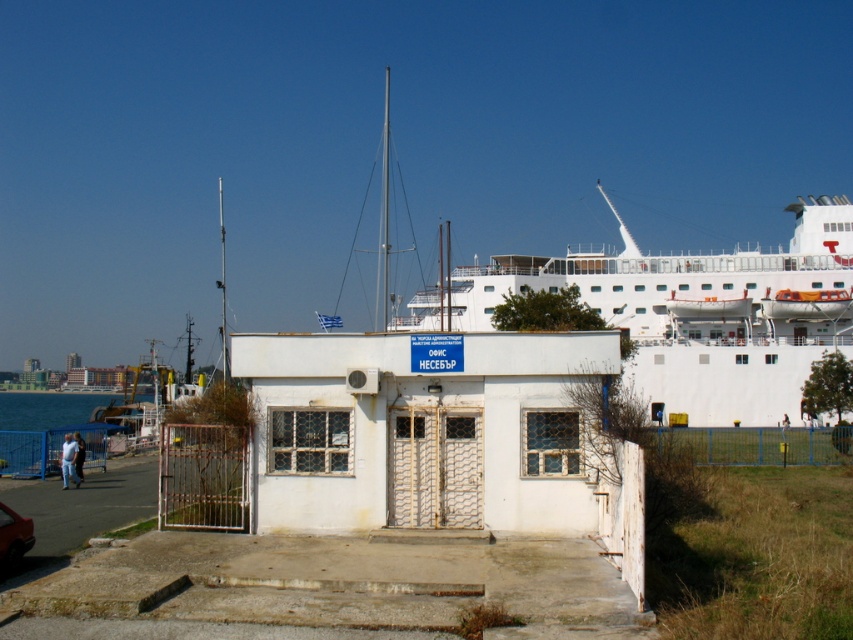
Is white glossy ship at upper center above blue water at lower left?

Yes.

Where is `white glossy ship at upper center`? white glossy ship at upper center is located at coordinates (701, 312).

This screenshot has height=640, width=853. I want to click on white glossy ship at upper center, so click(701, 312).

Is blue water at lower left above shiny red car at lower left?

Incorrect, blue water at lower left is not positioned above shiny red car at lower left.

Does blue water at lower left appear on the left side of shiny red car at lower left?

Indeed, blue water at lower left is positioned on the left side of shiny red car at lower left.

Who is more distant from viewer, (67, 401) or (16, 529)?

Positioned behind is point (67, 401).

This screenshot has height=640, width=853. I want to click on blue water at lower left, so click(48, 432).

Between white glossy ship at upper center and shiny red car at lower left, which one has more height?

With more height is white glossy ship at upper center.

I want to click on white glossy ship at upper center, so click(x=701, y=312).

In order to click on white glossy ship at upper center in this screenshot , I will do `click(701, 312)`.